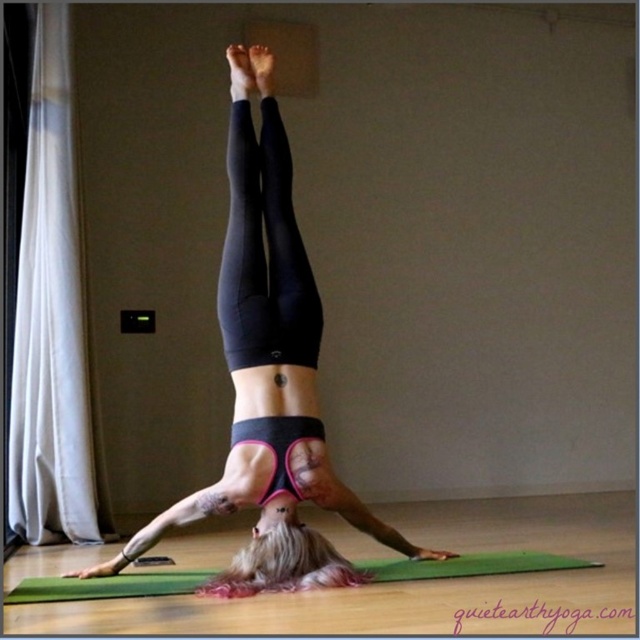
Does black matte leggings at center appear on the right side of green rubber yoga mat at center?

Incorrect, black matte leggings at center is not on the right side of green rubber yoga mat at center.

Does black matte leggings at center have a smaller size compared to green rubber yoga mat at center?

Incorrect, black matte leggings at center is not smaller in size than green rubber yoga mat at center.

What do you see at coordinates (268, 372) in the screenshot?
I see `black matte leggings at center` at bounding box center [268, 372].

The image size is (640, 640). Identify the location of black matte leggings at center. (268, 372).